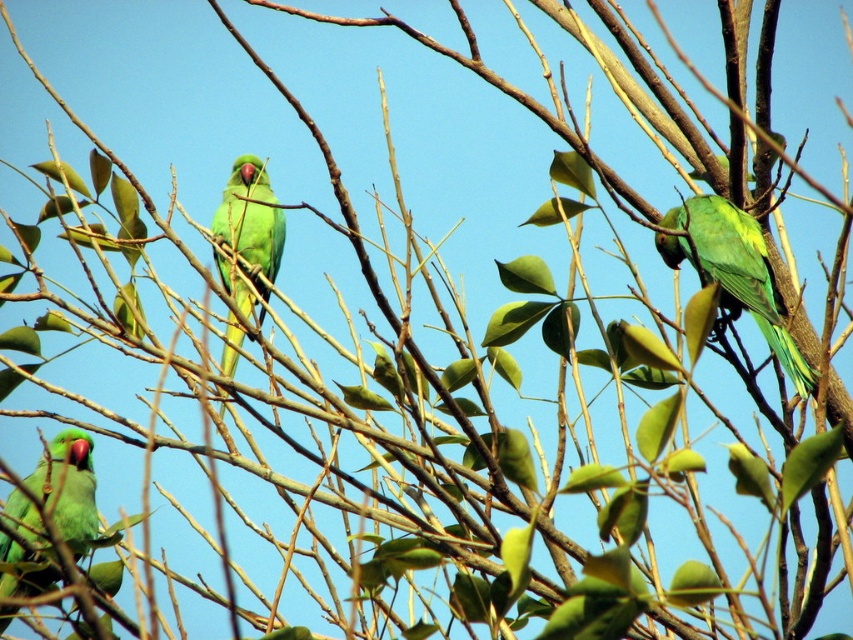
Does matte green parrot at lower left have a greater width compared to green matte parrot at center?

Correct, the width of matte green parrot at lower left exceeds that of green matte parrot at center.

Who is positioned more to the left, matte green parrot at lower left or green matte parrot at center?

Positioned to the left is matte green parrot at lower left.

Is point (45, 483) farther from camera compared to point (227, 326)?

No, it is not.

This screenshot has width=853, height=640. In order to click on matte green parrot at lower left in this screenshot , I will do click(68, 488).

Where is `green matte parrot at upper right`? green matte parrot at upper right is located at coordinates (733, 273).

Does green matte parrot at upper right have a larger size compared to green matte parrot at center?

No.

The height and width of the screenshot is (640, 853). I want to click on green matte parrot at upper right, so click(733, 273).

Find the location of `green matte parrot at upper right`. green matte parrot at upper right is located at coordinates (733, 273).

Is point (715, 220) positioned before point (55, 516)?

No, (715, 220) is behind (55, 516).

Can you confirm if green matte parrot at upper right is bigger than matte green parrot at lower left?

Indeed, green matte parrot at upper right has a larger size compared to matte green parrot at lower left.

Between point (769, 310) and point (68, 492), which one is positioned behind?

Point (68, 492)

Locate an element on the screen. The width and height of the screenshot is (853, 640). green matte parrot at upper right is located at coordinates (733, 273).